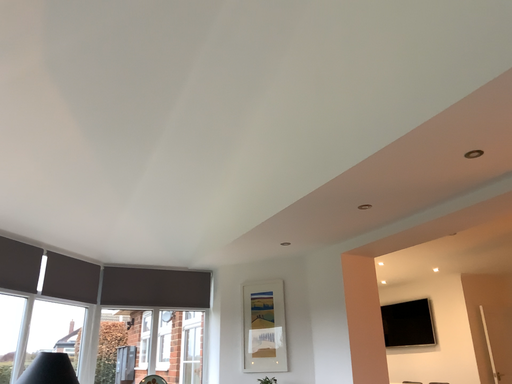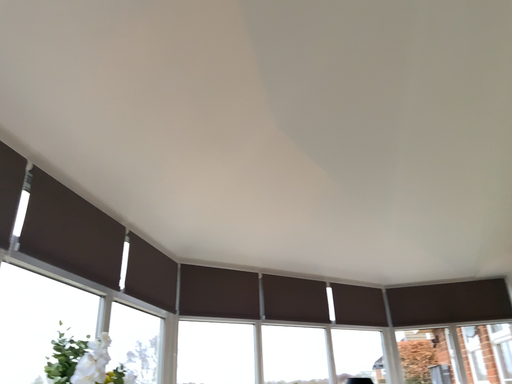
Question: How did the camera likely rotate when shooting the video?

Choices:
 (A) rotated right
 (B) rotated left

Answer: (B)